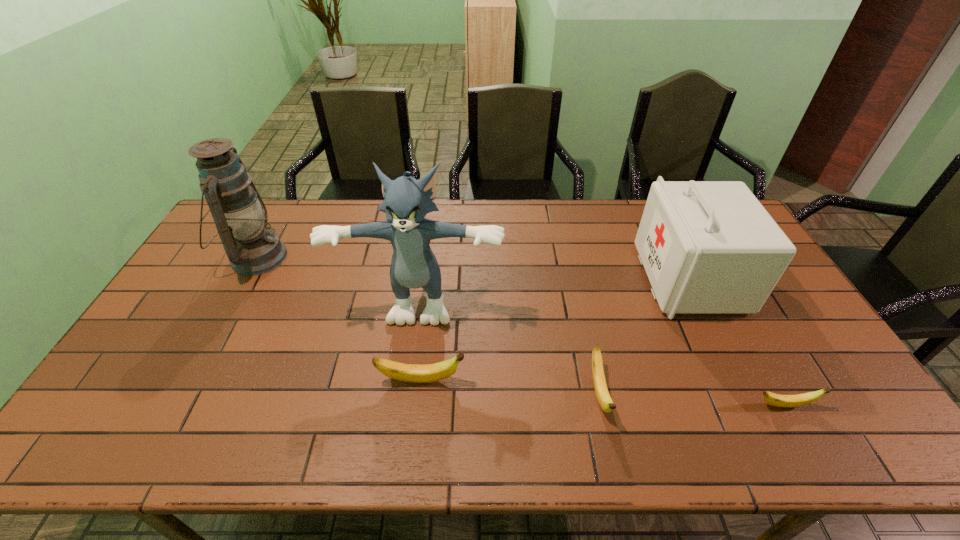
What are the coordinates of `free spot located 0.090m at the stem of the shortest banana` in the screenshot? It's located at (852, 406).

This screenshot has height=540, width=960. What are the coordinates of `vacant region located on the front-facing side of the first-aid kit` in the screenshot? It's located at (616, 278).

This screenshot has height=540, width=960. Identify the location of vacant space located on the front-facing side of the first-aid kit. (566, 278).

Identify the location of free spot located on the front-facing side of the first-aid kit. The image size is (960, 540). (611, 278).

Identify the location of free location located 0.240m on the front of the leftmost object. (206, 348).

Locate an element on the screen. free space located 0.090m on the front-facing side of the cat is located at coordinates (414, 354).

This screenshot has width=960, height=540. In order to click on object that is at the far edge in this screenshot , I will do `click(240, 216)`.

Where is `object present at the left edge`? This screenshot has width=960, height=540. object present at the left edge is located at coordinates (240, 216).

At what (x,y) coordinates should I click in order to perform the action: click on banana positioned at the right edge. Please return your answer as a coordinate pair (x, y). Looking at the image, I should click on (787, 401).

Locate an element on the screen. This screenshot has width=960, height=540. the first-aid kit positioned at the right edge is located at coordinates 708,247.